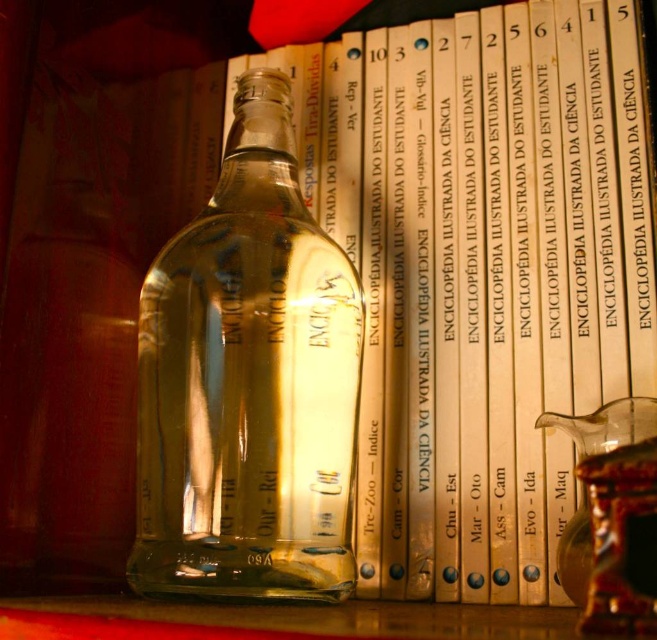
Question: Can you confirm if transparent glass bottle at center is positioned to the left of transparent glass jar at lower right?

Choices:
 (A) no
 (B) yes

Answer: (B)

Question: Is transparent glass bottle at center above transparent glass jar at lower right?

Choices:
 (A) no
 (B) yes

Answer: (B)

Question: Which point is closer to the camera?

Choices:
 (A) transparent glass bottle at center
 (B) transparent glass jar at lower right

Answer: (B)

Question: Can you confirm if transparent glass bottle at center is positioned to the left of transparent glass jar at lower right?

Choices:
 (A) no
 (B) yes

Answer: (B)